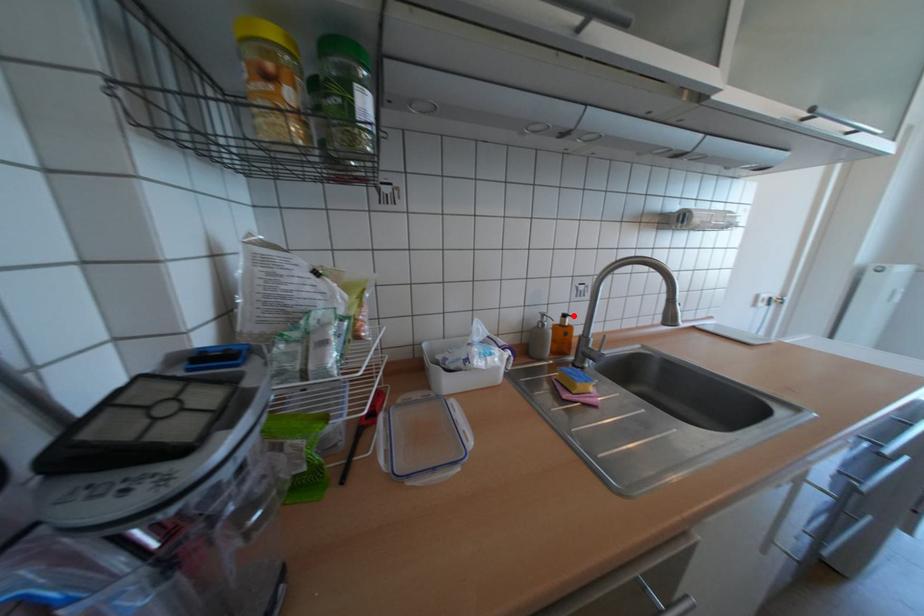
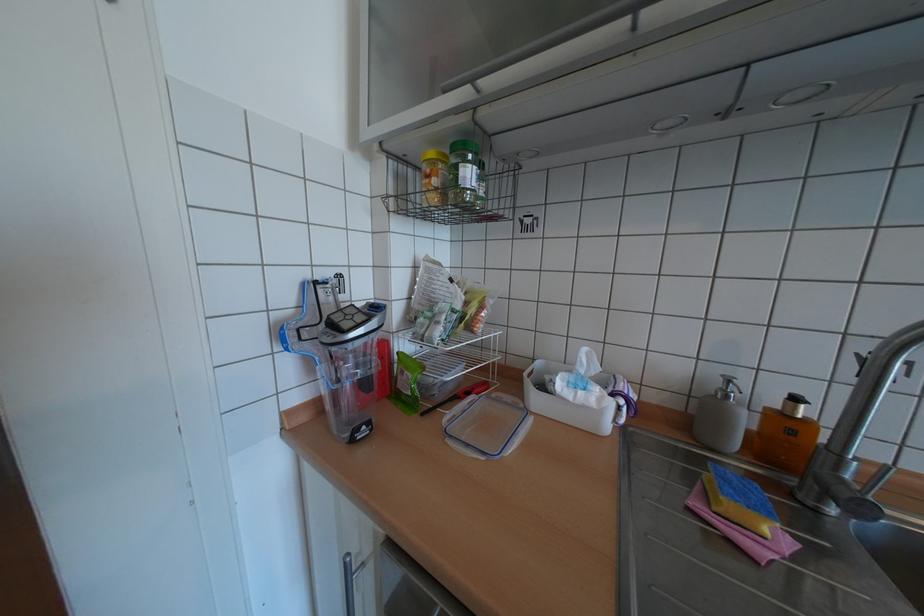
In the second image, find the point that corresponds to the highlighted location in the first image.

(805, 399)